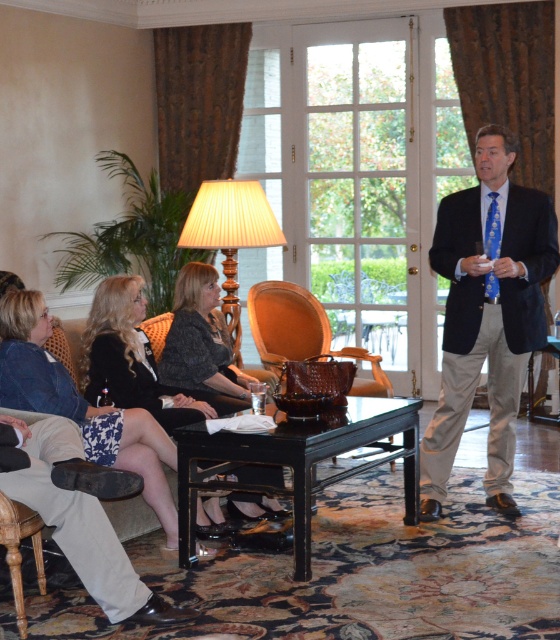
Question: Can you confirm if blue silk tie at center is positioned above denim jacket at lower left?

Choices:
 (A) yes
 (B) no

Answer: (A)

Question: Which object appears closest to the camera in this image?

Choices:
 (A) brown leather armchair at center
 (B) black textured dress at center

Answer: (B)

Question: Does black textured dress at center have a lesser width compared to beige fabric lampshade at center?

Choices:
 (A) no
 (B) yes

Answer: (B)

Question: Which point is farther to the camera?

Choices:
 (A) denim jacket at lower left
 (B) brown leather armchair at center
 (C) blue silk tie at center

Answer: (B)

Question: Is blue silk tie at center bigger than denim jacket at lower left?

Choices:
 (A) yes
 (B) no

Answer: (A)

Question: Among these points, which one is farthest from the camera?

Choices:
 (A) (238, 400)
 (B) (469, 291)

Answer: (A)